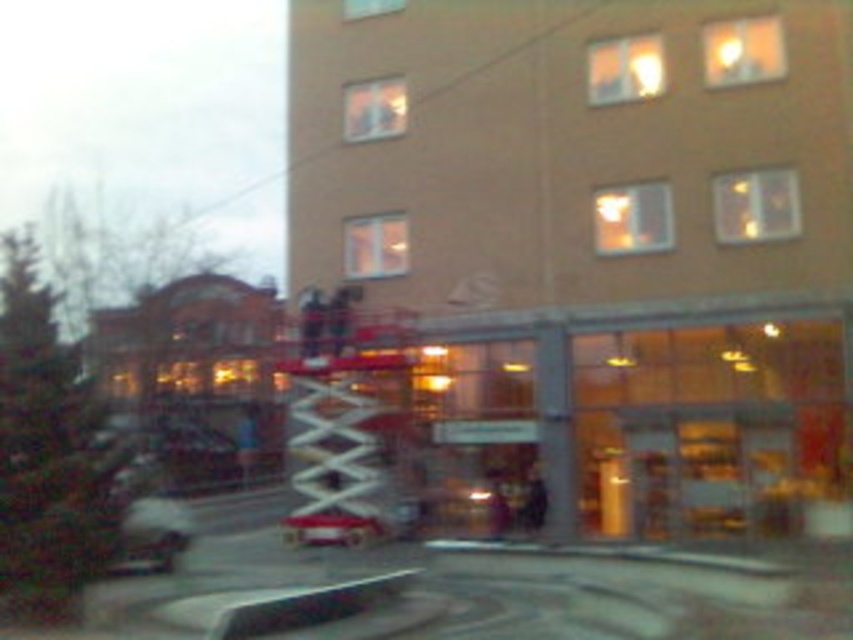
Question: Which point is farther from the camera taking this photo?

Choices:
 (A) (335, 515)
 (B) (144, 560)

Answer: (A)

Question: Observing the image, what is the correct spatial positioning of white metallic fire truck at center in reference to metallic silver car at lower left?

Choices:
 (A) below
 (B) above

Answer: (B)

Question: Is white metallic fire truck at center to the left of metallic silver car at lower left from the viewer's perspective?

Choices:
 (A) no
 (B) yes

Answer: (A)

Question: In this image, where is white metallic fire truck at center located relative to metallic silver car at lower left?

Choices:
 (A) left
 (B) right

Answer: (B)